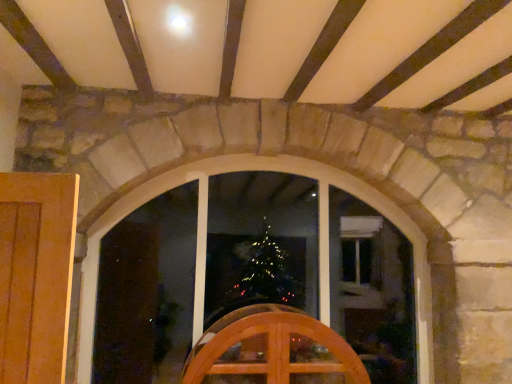
Question: Is wooden chair at center bigger or smaller than clear glass window at center?

Choices:
 (A) small
 (B) big

Answer: (A)

Question: Considering their positions, is wooden chair at center located in front of or behind clear glass window at center?

Choices:
 (A) front
 (B) behind

Answer: (A)

Question: In the image, is wooden chair at center on the left side or the right side of clear glass window at center?

Choices:
 (A) left
 (B) right

Answer: (B)

Question: From a real-world perspective, is clear glass window at center above or below wooden chair at center?

Choices:
 (A) above
 (B) below

Answer: (A)

Question: Would you say clear glass window at center is to the left or to the right of wooden chair at center in the picture?

Choices:
 (A) left
 (B) right

Answer: (A)

Question: Is clear glass window at center situated inside wooden chair at center or outside?

Choices:
 (A) inside
 (B) outside

Answer: (B)

Question: Is point (82, 283) closer or farther from the camera than point (245, 345)?

Choices:
 (A) farther
 (B) closer

Answer: (A)